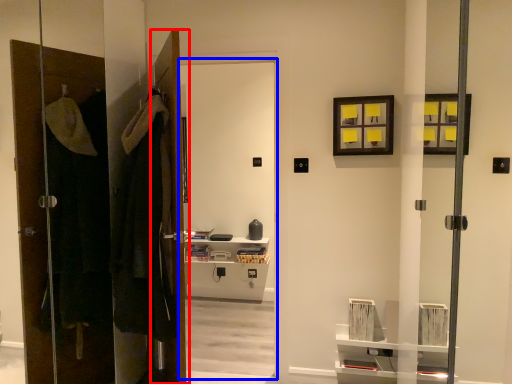
Question: Which object appears farthest to the camera in this image, door (highlighted by a red box) or screen door (highlighted by a blue box)?

Choices:
 (A) door
 (B) screen door

Answer: (B)